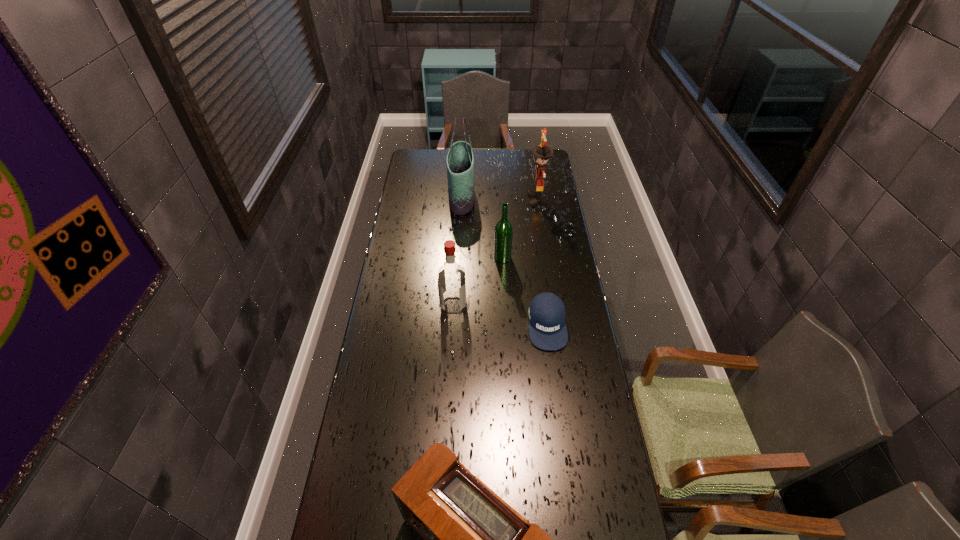
The image size is (960, 540). I want to click on free space between the tote bag and the nutcracker, so click(499, 199).

The width and height of the screenshot is (960, 540). Identify the location of vacant space in between the fourth nearest object and the liquor. (478, 281).

I want to click on free spot between the baseball cap and the nutcracker, so pyautogui.click(x=542, y=262).

Identify which object is the second nearest to the tote bag. Please provide its 2D coordinates. Your answer should be formatted as a tuple, i.e. [(x, y)], where the tuple contains the x and y coordinates of a point satisfying the conditions above.

[(542, 152)]

Identify which object is the fourth nearest to the tote bag. Please provide its 2D coordinates. Your answer should be formatted as a tuple, i.e. [(x, y)], where the tuple contains the x and y coordinates of a point satisfying the conditions above.

[(547, 330)]

Where is `vacant area in the image that satisfies the following two spatial constraints: 1. on the front-facing side of the nutcracker; 2. on the front side of the third farthest object`? vacant area in the image that satisfies the following two spatial constraints: 1. on the front-facing side of the nutcracker; 2. on the front side of the third farthest object is located at coordinates (546, 257).

You are a GUI agent. You are given a task and a screenshot of the screen. Output one action in this format:
    pyautogui.click(x=<x>, y=<y>)
    Task: Click on the blank area in the image that satisfies the following two spatial constraints: 1. on the front-facing side of the nutcracker; 2. on the front side of the fourth nearest object
    The width and height of the screenshot is (960, 540).
    Given the screenshot: What is the action you would take?
    pyautogui.click(x=546, y=257)